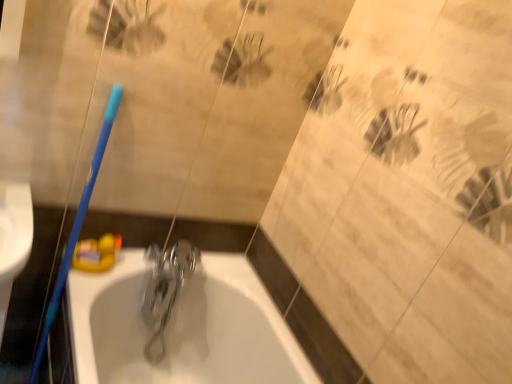
Question: Can you confirm if polished metallic faucet at center is bigger than white glossy bathtub at center?

Choices:
 (A) yes
 (B) no

Answer: (B)

Question: Is white glossy bathtub at center surrounded by polished metallic faucet at center?

Choices:
 (A) yes
 (B) no

Answer: (B)

Question: Is white glossy bathtub at center at the back of polished metallic faucet at center?

Choices:
 (A) no
 (B) yes

Answer: (B)

Question: Does polished metallic faucet at center appear on the left side of white glossy bathtub at center?

Choices:
 (A) yes
 (B) no

Answer: (A)

Question: Can you confirm if polished metallic faucet at center is taller than white glossy bathtub at center?

Choices:
 (A) yes
 (B) no

Answer: (B)

Question: In terms of height, does white glossy bathtub at center look taller or shorter compared to blue plastic toothbrush at left?

Choices:
 (A) short
 (B) tall

Answer: (A)

Question: Considering the positions of white glossy bathtub at center and blue plastic toothbrush at left in the image, is white glossy bathtub at center bigger or smaller than blue plastic toothbrush at left?

Choices:
 (A) small
 (B) big

Answer: (B)

Question: From a real-world perspective, is white glossy bathtub at center physically located above or below blue plastic toothbrush at left?

Choices:
 (A) below
 (B) above

Answer: (A)

Question: Is white glossy bathtub at center in front of or behind blue plastic toothbrush at left in the image?

Choices:
 (A) front
 (B) behind

Answer: (B)

Question: From a real-world perspective, relative to white glossy bathtub at center, is polished metallic faucet at center vertically above or below?

Choices:
 (A) above
 (B) below

Answer: (A)

Question: Visually, is polished metallic faucet at center positioned to the left or to the right of white glossy bathtub at center?

Choices:
 (A) left
 (B) right

Answer: (A)

Question: Is polished metallic faucet at center in front of or behind white glossy bathtub at center in the image?

Choices:
 (A) behind
 (B) front

Answer: (A)

Question: Considering the positions of polished metallic faucet at center and white glossy bathtub at center in the image, is polished metallic faucet at center bigger or smaller than white glossy bathtub at center?

Choices:
 (A) small
 (B) big

Answer: (A)

Question: In terms of height, does blue plastic toothbrush at left look taller or shorter compared to polished metallic faucet at center?

Choices:
 (A) short
 (B) tall

Answer: (B)

Question: Considering the relative positions of blue plastic toothbrush at left and polished metallic faucet at center in the image provided, is blue plastic toothbrush at left to the left or to the right of polished metallic faucet at center?

Choices:
 (A) right
 (B) left

Answer: (B)